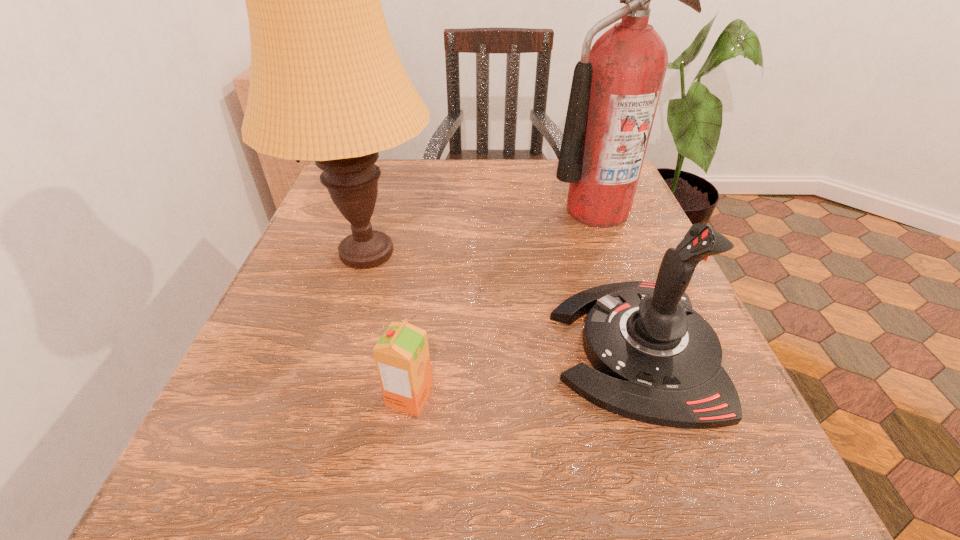
Locate an element on the screen. This screenshot has width=960, height=540. object that is at the far edge is located at coordinates (616, 86).

Locate an element on the screen. The width and height of the screenshot is (960, 540). object that is at the left edge is located at coordinates (327, 85).

Find the location of a particular element. fire extinguisher at the right edge is located at coordinates (616, 86).

Where is `joystick located at the right edge`? joystick located at the right edge is located at coordinates tap(658, 361).

Image resolution: width=960 pixels, height=540 pixels. Identify the location of object that is positioned at the far right corner. (616, 86).

The height and width of the screenshot is (540, 960). Find the location of `vacant space at the far edge`. vacant space at the far edge is located at coordinates (400, 194).

The height and width of the screenshot is (540, 960). I want to click on free region at the near edge of the desktop, so click(x=530, y=475).

What are the coordinates of `free space at the left edge` in the screenshot? It's located at (280, 399).

In the image, there is a desktop. What are the coordinates of `free space at the right edge` in the screenshot? It's located at (685, 453).

The image size is (960, 540). In the image, there is a desktop. Identify the location of blank space at the far left corner. (395, 186).